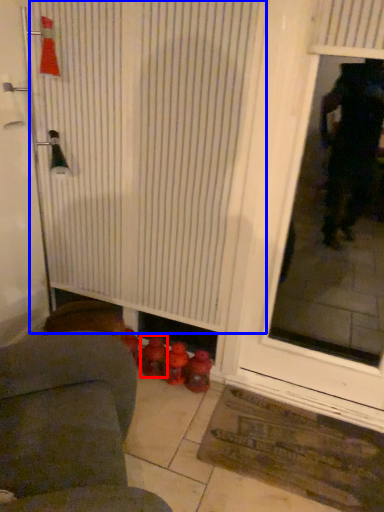
Question: Which object appears closest to the camera in this image, toy (highlighted by a red box) or shower curtain (highlighted by a blue box)?

Choices:
 (A) toy
 (B) shower curtain

Answer: (B)